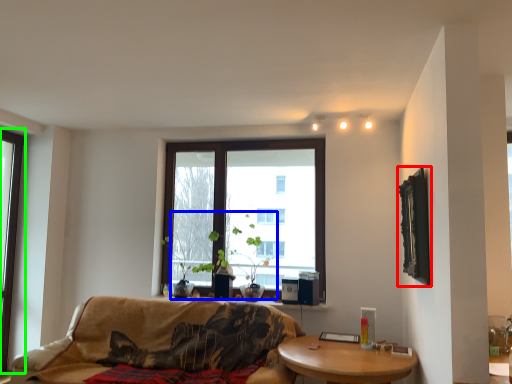
Question: Which is nearer to the picture frame (highlighted by a red box)? plant (highlighted by a blue box) or window (highlighted by a green box).

Choices:
 (A) plant
 (B) window

Answer: (A)